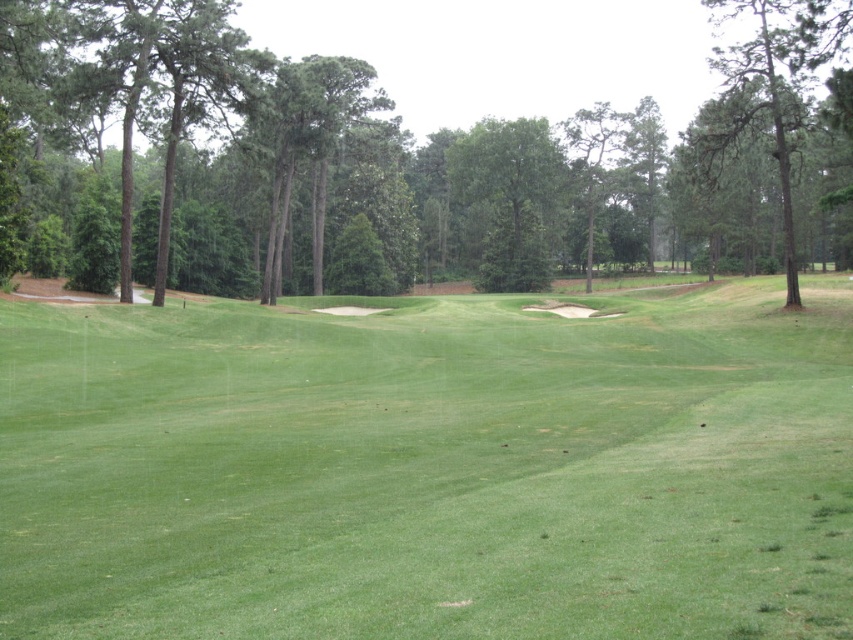
In the golf course scene, there is a point labeled as point (412,157). Based on the description, what object is located at that point?

The point (412,157) corresponds to the green leafy tree at center.

You are a golfer preparing to hit your ball from the green grassy fairway at center. You notice a green textured pine tree at upper right in the background. Which object occupies a larger area in the image?

The green textured pine tree at upper right occupies a larger area in the image compared to the green grassy fairway at center.

You are a golfer standing on the green grassy fairway at center and want to hit the ball towards the green leafy tree at center. Based on the scene description, will the tree block your view of the fairway? Please explain.

The green grassy fairway at center is below the green leafy tree at center, so the tree will block your view of the fairway.